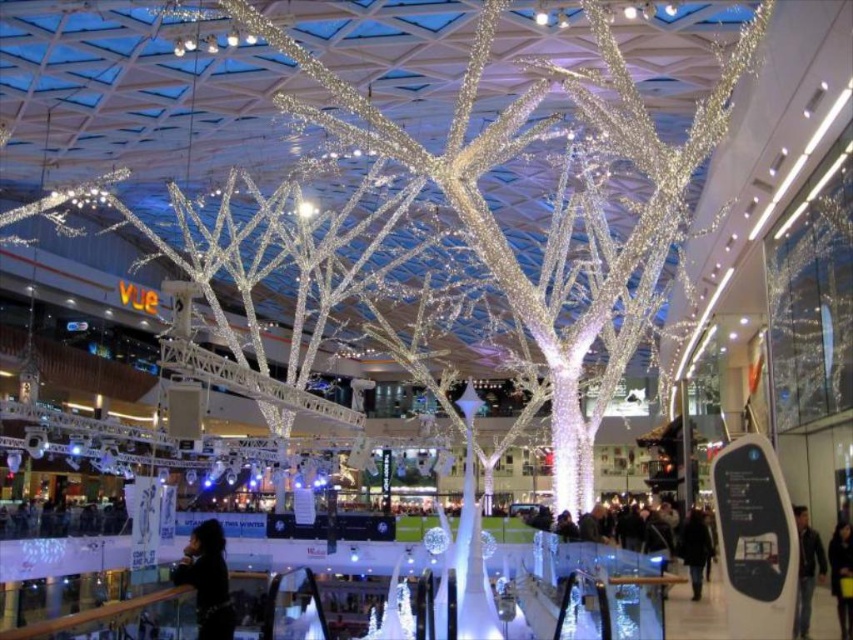
You are standing in the shopping mall and want to approach the dark hair at lower left and the dark brown leather jacket at lower right. Which object will you reach first?

You will reach the dark hair at lower left first because it is closer to you than the dark brown leather jacket at lower right.